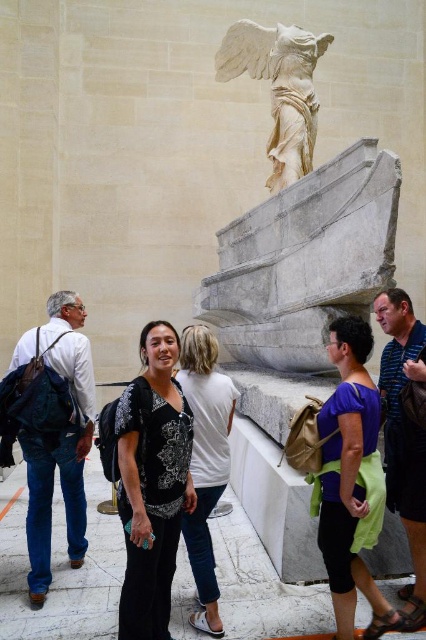
Who is lower down, denim jeans at left or striped cotton shirt at center?

denim jeans at left

From the picture: Between denim jeans at left and striped cotton shirt at center, which one has more height?

With more height is striped cotton shirt at center.

Where is `denim jeans at left`? This screenshot has height=640, width=426. denim jeans at left is located at coordinates (57, 436).

Can you confirm if purple fabric at center is bigger than denim jeans at left?

No.

From the picture: Is purple fabric at center taller than denim jeans at left?

No, purple fabric at center is not taller than denim jeans at left.

In the scene shown: Who is more distant from viewer, [362,493] or [34,332]?

Positioned behind is point [34,332].

At what (x,y) coordinates should I click in order to perform the action: click on purple fabric at center. Please return your answer as a coordinate pair (x, y). The height and width of the screenshot is (640, 426). Looking at the image, I should click on (351, 481).

Based on the photo, does purple fabric at center have a lesser height compared to white marble winged statue at upper center?

Yes.

Where is `purple fabric at center`? purple fabric at center is located at coordinates (351, 481).